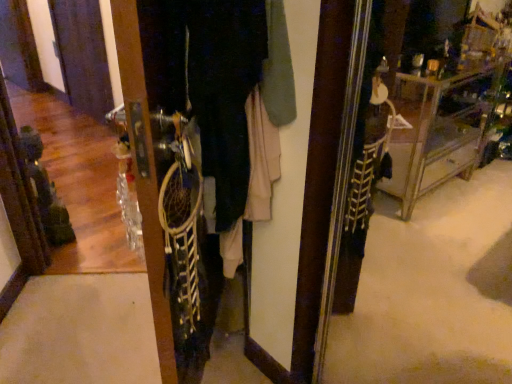
This screenshot has width=512, height=384. I want to click on free point below white fabric dreamcatcher at center (from a real-world perspective), so click(x=244, y=367).